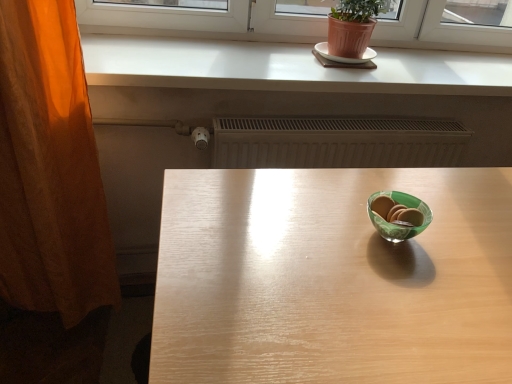
What is the approximate width of white ceramic plate at upper center?

white ceramic plate at upper center is 9.29 inches in width.

Identify the location of white ceramic plate at upper center. (343, 57).

Can you confirm if light wood table at center is taller than white matte counter top at upper center?

Yes, light wood table at center is taller than white matte counter top at upper center.

From the image's perspective, is light wood table at center below white matte counter top at upper center?

Indeed, from the image's perspective, light wood table at center is shown beneath white matte counter top at upper center.

Is light wood table at center thinner than white matte counter top at upper center?

Incorrect, the width of light wood table at center is not less than that of white matte counter top at upper center.

Which is behind, point (422, 319) or point (441, 76)?

The point (441, 76) is farther.

This screenshot has height=384, width=512. I want to click on curtain on the left of light wood table at center, so click(50, 168).

Is orange fabric curtain at left shorter than light wood table at center?

No, orange fabric curtain at left is not shorter than light wood table at center.

Considering the relative sizes of orange fabric curtain at left and light wood table at center in the image provided, is orange fabric curtain at left smaller than light wood table at center?

Correct, orange fabric curtain at left occupies less space than light wood table at center.

Would you say orange fabric curtain at left is a long distance from light wood table at center?

No, orange fabric curtain at left is not far from light wood table at center.

Can you confirm if orange fabric curtain at left is shorter than white ceramic plate at upper center?

No.

Is white ceramic plate at upper center inside orange fabric curtain at left?

No, white ceramic plate at upper center is not surrounded by orange fabric curtain at left.

Measure the distance between orange fabric curtain at left and white ceramic plate at upper center.

orange fabric curtain at left and white ceramic plate at upper center are 3.51 feet apart from each other.

From a real-world perspective, is orange fabric curtain at left located higher than white ceramic plate at upper center?

No, from a real-world perspective, orange fabric curtain at left is not above white ceramic plate at upper center.

How different are the orientations of orange fabric curtain at left and white matte counter top at upper center in degrees?

The facing directions of orange fabric curtain at left and white matte counter top at upper center are 2.5 degrees apart.

Which is closer, (69, 179) or (117, 57)?

Clearly, point (69, 179) is closer to the camera than point (117, 57).

This screenshot has height=384, width=512. I want to click on counter top behind the orange fabric curtain at left, so click(x=287, y=68).

From the picture: Is orange fabric curtain at left directly adjacent to white matte counter top at upper center?

No, orange fabric curtain at left is not touching white matte counter top at upper center.

Is white ceramic plate at upper center not within white matte counter top at upper center?

white ceramic plate at upper center lies outside white matte counter top at upper center's area.

Considering the relative positions of white ceramic plate at upper center and white matte counter top at upper center in the image provided, is white ceramic plate at upper center to the right of white matte counter top at upper center from the viewer's perspective?

Correct, you'll find white ceramic plate at upper center to the right of white matte counter top at upper center.

From a real-world perspective, is white ceramic plate at upper center above or below white matte counter top at upper center?

From a real-world perspective, white ceramic plate at upper center is physically above white matte counter top at upper center.

Which of these two, white ceramic plate at upper center or white matte counter top at upper center, is wider?

white matte counter top at upper center.

What's the angular difference between white matte counter top at upper center and white ceramic plate at upper center's facing directions?

white matte counter top at upper center and white ceramic plate at upper center are facing 0.439 degrees away from each other.

Is white matte counter top at upper center next to white ceramic plate at upper center?

They are not placed beside each other.

Can we say white matte counter top at upper center lies outside white ceramic plate at upper center?

Yes, white matte counter top at upper center is outside of white ceramic plate at upper center.

Is white matte counter top at upper center oriented away from white ceramic plate at upper center?

No.

Is point (225, 72) farther from viewer compared to point (344, 239)?

Yes, it is behind point (344, 239).

Which of these two, white matte counter top at upper center or light wood table at center, is smaller?

With smaller size is white matte counter top at upper center.

From the image's perspective, which object appears higher, white matte counter top at upper center or light wood table at center?

white matte counter top at upper center, from the image's perspective.

In the scene shown: Is white matte counter top at upper center not within light wood table at center?

white matte counter top at upper center lies outside light wood table at center's area.

At what (x,y) coordinates should I click in order to perform the action: click on table in front of the white matte counter top at upper center. Please return your answer as a coordinate pair (x, y). Looking at the image, I should click on 332,279.

Find the location of `curtain behind the light wood table at center`. curtain behind the light wood table at center is located at coordinates (50, 168).

Estimate the real-world distances between objects in this image. Which object is closer to orange fabric curtain at left, light wood table at center or white matte counter top at upper center?

Based on the image, white matte counter top at upper center appears to be nearer to orange fabric curtain at left.

From the image, which object appears to be nearer to white ceramic plate at upper center, light wood table at center or white matte counter top at upper center?

Based on the image, white matte counter top at upper center appears to be nearer to white ceramic plate at upper center.

Consider the image. Which object lies nearer to the anchor point white matte counter top at upper center, white ceramic plate at upper center or light wood table at center?

The object closer to white matte counter top at upper center is white ceramic plate at upper center.

Looking at the image, which one is located closer to orange fabric curtain at left, white ceramic plate at upper center or white matte counter top at upper center?

white matte counter top at upper center.

Looking at this image, when comparing their distances from white ceramic plate at upper center, does white matte counter top at upper center or light wood table at center seem closer?

white matte counter top at upper center is positioned closer to the anchor white ceramic plate at upper center.

Considering their positions, is light wood table at center positioned further to white ceramic plate at upper center than orange fabric curtain at left?

orange fabric curtain at left lies further to white ceramic plate at upper center than the other object.

When comparing their distances from orange fabric curtain at left, does white ceramic plate at upper center or light wood table at center seem closer?

light wood table at center.

Considering their positions, is white matte counter top at upper center positioned further to light wood table at center than white ceramic plate at upper center?

Based on the image, white ceramic plate at upper center appears to be further to light wood table at center.

Locate an element on the screen. counter top between white ceramic plate at upper center and light wood table at center in the vertical direction is located at coordinates (287, 68).

The width and height of the screenshot is (512, 384). In order to click on counter top between orange fabric curtain at left and light wood table at center from left to right in this screenshot , I will do click(287, 68).

Where is `counter top between orange fabric curtain at left and white ceramic plate at upper center from left to right`? This screenshot has height=384, width=512. counter top between orange fabric curtain at left and white ceramic plate at upper center from left to right is located at coordinates (287, 68).

You are a GUI agent. You are given a task and a screenshot of the screen. Output one action in this format:
    pyautogui.click(x=<x>, y=<y>)
    Task: Click on the plate situated between orange fabric curtain at left and light wood table at center from left to right
    The height and width of the screenshot is (384, 512).
    Given the screenshot: What is the action you would take?
    pyautogui.click(x=343, y=57)